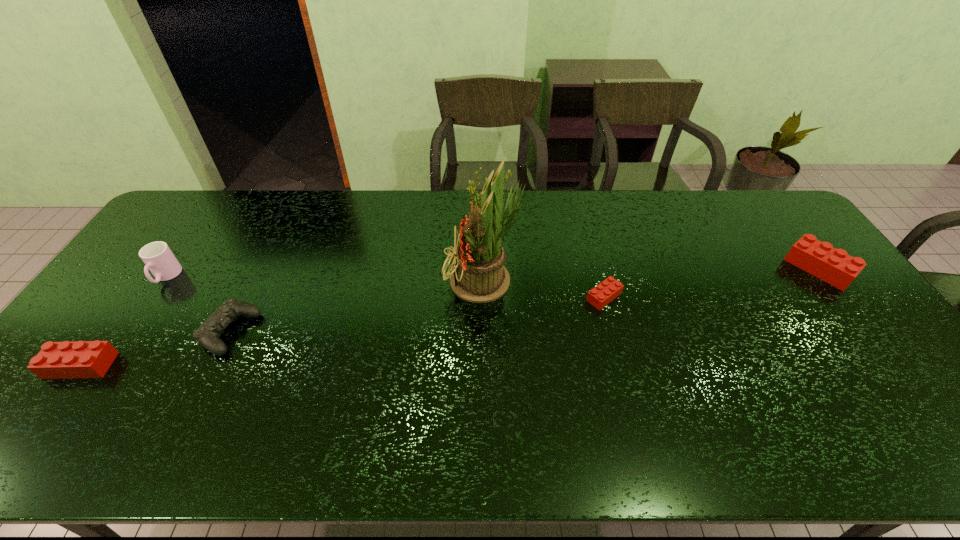
Locate an element on the screen. The width and height of the screenshot is (960, 540). vacant space that satisfies the following two spatial constraints: 1. in front of the third object from right to left with the fan visible; 2. on the front side of the control is located at coordinates (488, 333).

Where is `vacant space that satisfies the following two spatial constraints: 1. on the back side of the leftmost Lego; 2. on the right side of the third object from left to right`? This screenshot has height=540, width=960. vacant space that satisfies the following two spatial constraints: 1. on the back side of the leftmost Lego; 2. on the right side of the third object from left to right is located at coordinates (106, 333).

The width and height of the screenshot is (960, 540). What are the coordinates of `vacant space that satisfies the following two spatial constraints: 1. with the handle on the side of the second Lego from right to left; 2. on the left side of the cup` in the screenshot? It's located at (153, 296).